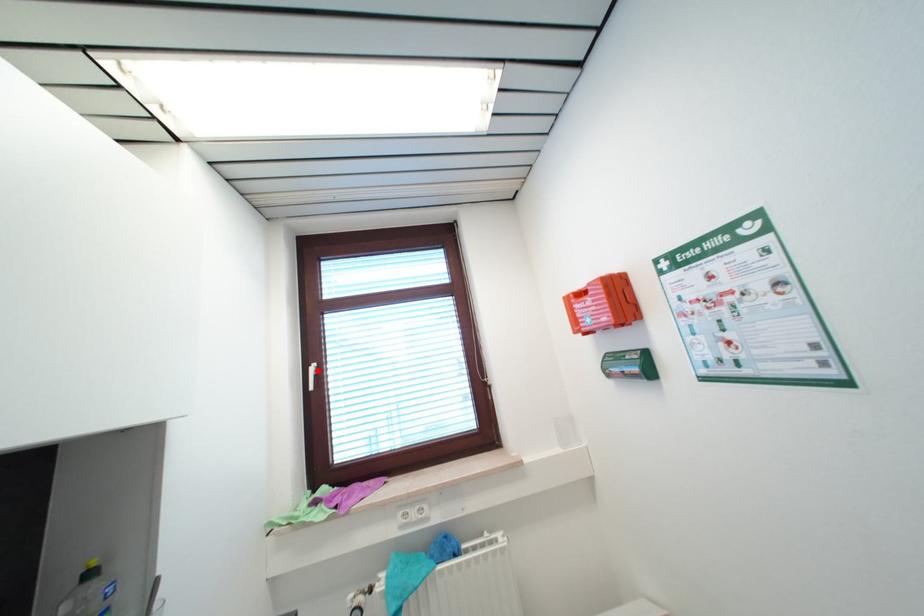
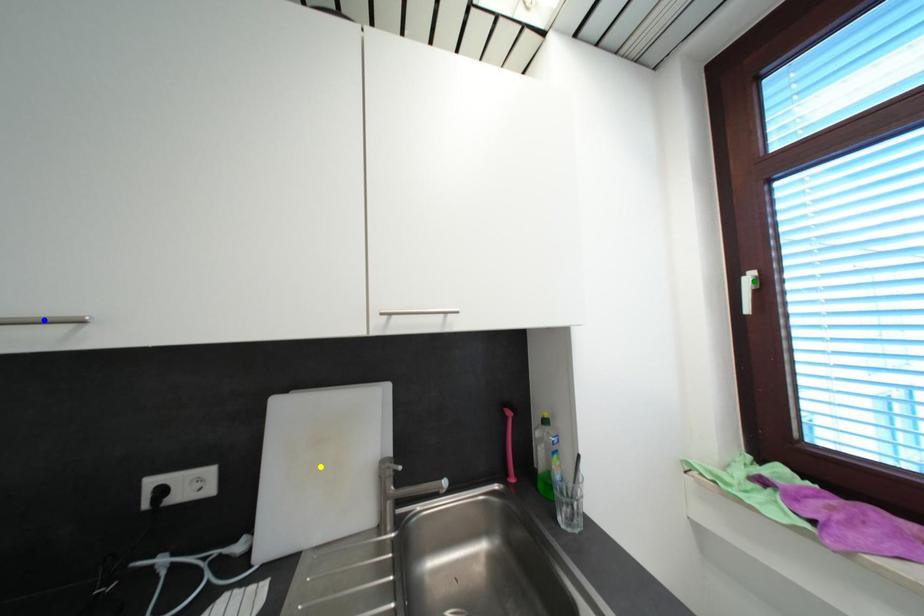
Question: I am providing you with two images of the same scene from different viewpoints. A red point is marked on the first image. You are given multiple points on the second image. Which point in image 2 is actually the same real-world point as the red point in image 1?

Choices:
 (A) blue point
 (B) green point
 (C) yellow point

Answer: (B)